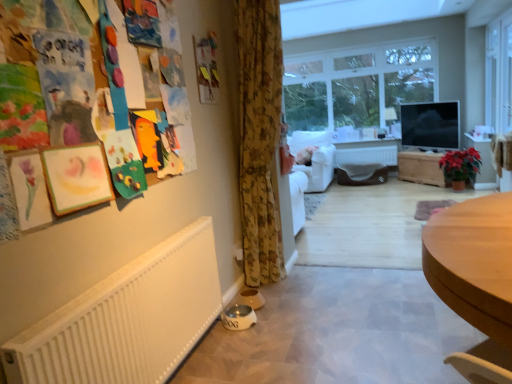
Where is `green matte plant at right`? green matte plant at right is located at coordinates (460, 164).

In order to face green matte plant at right, should I rotate leftwards or rightwards?

A 25.482 degree turn to the right will do.

Based on the photo, in order to face transparent glass window at upper right, positioned as the 2th window in left-to-right order, should I rotate leftwards or rightwards?

You should rotate right by 29.304 degrees.

Image resolution: width=512 pixels, height=384 pixels. What are the coordinates of `white matte radiator at center` in the screenshot? It's located at 367,155.

Image resolution: width=512 pixels, height=384 pixels. Identify the location of white glossy dog bowl at lower left. (338, 332).

Image resolution: width=512 pixels, height=384 pixels. Describe the element at coordinates (475, 279) in the screenshot. I see `light brown wooden desk at lower right` at that location.

Where is `green matte plant at right`? The height and width of the screenshot is (384, 512). green matte plant at right is located at coordinates (460, 164).

Which object is thinner, clear glass window at center, the first window from the left, or transparent glass window at upper right, the 2th window in the back-to-front sequence?

clear glass window at center, the first window from the left, is thinner.

From a real-world perspective, relative to transparent glass window at upper right, the 2th window in the back-to-front sequence, is clear glass window at center, which appears as the 1th window when viewed from the back, vertically above or below?

clear glass window at center, which appears as the 1th window when viewed from the back, is above transparent glass window at upper right, the 2th window in the back-to-front sequence.

From the picture: Is clear glass window at center, which is the 2th window from right to left, facing towards transparent glass window at upper right, the 2th window in the back-to-front sequence?

No, clear glass window at center, which is the 2th window from right to left, is not facing towards transparent glass window at upper right, the 2th window in the back-to-front sequence.

Where is `window on the right of clear glass window at center, which appears as the 1th window when viewed from the back`? This screenshot has width=512, height=384. window on the right of clear glass window at center, which appears as the 1th window when viewed from the back is located at coordinates (499, 74).

Is the surface of clear glass window at center, which appears as the 1th window when viewed from the back, in direct contact with light brown wooden desk at lower right?

→ There is a gap between clear glass window at center, which appears as the 1th window when viewed from the back, and light brown wooden desk at lower right.

Is clear glass window at center, which appears as the 1th window when viewed from the back, at the right side of light brown wooden desk at lower right?

Yes.

Is clear glass window at center, which appears as the 1th window when viewed from the back, oriented away from light brown wooden desk at lower right?

That's not correct — clear glass window at center, which appears as the 1th window when viewed from the back, is not looking away from light brown wooden desk at lower right.

Does point (332, 118) come farther from viewer compared to point (449, 363)?

Yes.

Considering the relative positions of floral fabric curtain at center and white glossy dog bowl at lower left in the image provided, is floral fabric curtain at center to the left or to the right of white glossy dog bowl at lower left?

Clearly, floral fabric curtain at center is on the left of white glossy dog bowl at lower left in the image.

Is floral fabric curtain at center facing towards white glossy dog bowl at lower left?

No, floral fabric curtain at center is not turned towards white glossy dog bowl at lower left.

Find the location of `plain that appears below the floral fabric curtain at center (from the image's perspective)`. plain that appears below the floral fabric curtain at center (from the image's perspective) is located at coordinates (338, 332).

Between point (270, 276) and point (362, 281), which one is positioned behind?

The point (270, 276) is farther.

Is wooden chest at center facing towards green matte plant at right?

No, wooden chest at center is not turned towards green matte plant at right.

Which object is wider, wooden chest at center or green matte plant at right?

wooden chest at center is wider.

From the image's perspective, is wooden chest at center positioned above or below green matte plant at right?

From the image's perspective, wooden chest at center appears above green matte plant at right.

Does white matte radiator at center have a lesser width compared to wooden chest at center?

Yes, white matte radiator at center is thinner than wooden chest at center.

Between white matte radiator at center and wooden chest at center, which one has larger size?

wooden chest at center.

Considering the sizes of white matte radiator at center and wooden chest at center in the image, is white matte radiator at center taller or shorter than wooden chest at center?

Clearly, white matte radiator at center is shorter compared to wooden chest at center.

Measure the distance between white matte radiator at center and wooden chest at center.

white matte radiator at center and wooden chest at center are 18.86 inches apart.

Considering the sizes of white glossy dog bowl at lower left and wooden chest at center in the image, is white glossy dog bowl at lower left bigger or smaller than wooden chest at center?

Considering their sizes, white glossy dog bowl at lower left takes up less space than wooden chest at center.

From the image's perspective, is white glossy dog bowl at lower left on top of wooden chest at center?

Incorrect, from the image's perspective, white glossy dog bowl at lower left is lower than wooden chest at center.

Is white glossy dog bowl at lower left positioned in front of wooden chest at center?

Yes, it is in front of wooden chest at center.

Is wooden chest at center to the left of white fabric armchair at center from the viewer's perspective?

In fact, wooden chest at center is to the right of white fabric armchair at center.

At what (x,y) coordinates should I click in order to perform the action: click on armchair above the wooden chest at center (from the image's perspective). Please return your answer as a coordinate pair (x, y). Looking at the image, I should click on (315, 158).

Is wooden chest at center far from white fabric armchair at center?

Yes, wooden chest at center and white fabric armchair at center are quite far apart.

Does wooden chest at center have a larger size compared to white fabric armchair at center?

Actually, wooden chest at center might be smaller than white fabric armchair at center.

Where is `window located below the clear glass window at center, which is the 2th window from right to left (from the image's perspective)`? Image resolution: width=512 pixels, height=384 pixels. window located below the clear glass window at center, which is the 2th window from right to left (from the image's perspective) is located at coordinates (499, 74).

From a real-world perspective, starting from the light brown wooden desk at lower right, which window is the 2nd one vertically above it? Please provide its 2D coordinates.

[(359, 86)]

Looking at the image, which one is located further to white glossy dog bowl at lower left, white fabric armchair at center or transparent glass window at upper right, which is counted as the 1th window, starting from the front?

transparent glass window at upper right, which is counted as the 1th window, starting from the front, is further to white glossy dog bowl at lower left.

Which object lies nearer to the anchor point white matte radiator at center, white glossy dog bowl at lower left or white fabric armchair at center?

Among the two, white fabric armchair at center is located nearer to white matte radiator at center.

Considering their positions, is transparent glass window at upper right, positioned as the first window in right-to-left order, positioned further to white fabric armchair at center than floral fabric curtain at center?

floral fabric curtain at center is further to white fabric armchair at center.

Looking at the image, which one is located further to clear glass window at center, which is the 2th window from right to left, white glossy dog bowl at lower left or white fabric armchair at center?

The object further to clear glass window at center, which is the 2th window from right to left, is white glossy dog bowl at lower left.

Looking at the image, which one is located closer to white glossy dog bowl at lower left, floral fabric curtain at center or wooden chest at center?

floral fabric curtain at center is closer to white glossy dog bowl at lower left.

Estimate the real-world distances between objects in this image. Which object is closer to clear glass window at center, which is the 2th window from right to left, white fabric armchair at center or light brown wooden desk at lower right?

Based on the image, white fabric armchair at center appears to be nearer to clear glass window at center, which is the 2th window from right to left.

Estimate the real-world distances between objects in this image. Which object is further from clear glass window at center, which appears as the 1th window when viewed from the back, light brown wooden desk at lower right or white glossy dog bowl at lower left?

The object further to clear glass window at center, which appears as the 1th window when viewed from the back, is light brown wooden desk at lower right.

From the picture: Considering their positions, is clear glass window at center, which is the 2th window from right to left, positioned closer to transparent glass window at upper right, which is counted as the 1th window, starting from the front, than green matte plant at right?

Based on the image, green matte plant at right appears to be nearer to transparent glass window at upper right, which is counted as the 1th window, starting from the front.

Where is `flower between floral fabric curtain at center and transparent glass window at upper right, positioned as the first window in right-to-left order, in the horizontal direction`? This screenshot has height=384, width=512. flower between floral fabric curtain at center and transparent glass window at upper right, positioned as the first window in right-to-left order, in the horizontal direction is located at coordinates [x=460, y=164].

This screenshot has height=384, width=512. In order to click on window positioned between light brown wooden desk at lower right and wooden chest at center from near to far in this screenshot , I will do `click(499, 74)`.

The image size is (512, 384). I want to click on armchair between light brown wooden desk at lower right and clear glass window at center, which ranks as the second window in front-to-back order, in the front-back direction, so click(x=315, y=158).

The image size is (512, 384). I want to click on table between floral fabric curtain at center and clear glass window at center, which is the 2th window from right to left, from front to back, so click(x=421, y=168).